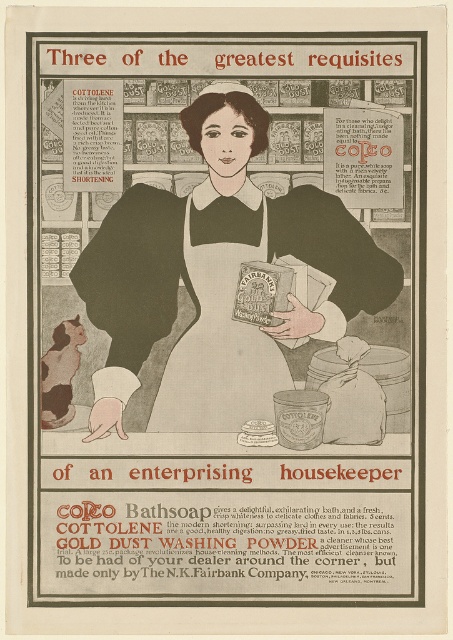
Can you confirm if matte black apron at center is positioned to the right of matte cardboard box at center?

No, matte black apron at center is not to the right of matte cardboard box at center.

Is the position of matte black apron at center more distant than that of matte cardboard box at center?

No.

Is point (297, 236) behind point (242, 426)?

Yes.

Identify the location of matte black apron at center. (217, 278).

Which is more to the right, white cotton apron at center or matte cardboard box at center?

Positioned to the right is matte cardboard box at center.

Between point (236, 369) and point (244, 433), which one is positioned in front?

Point (236, 369)

Is point (221, 257) closer to viewer compared to point (244, 435)?

That is False.

The image size is (453, 640). I want to click on white cotton apron at center, so click(220, 337).

Between matte black apron at center and white cotton apron at center, which one has more height?

With more height is matte black apron at center.

Does matte black apron at center come behind white cotton apron at center?

No, matte black apron at center is closer to the viewer.

Is point (251, 115) closer to viewer compared to point (276, 348)?

No, (251, 115) is behind (276, 348).

The image size is (453, 640). What are the coordinates of `matte black apron at center` in the screenshot? It's located at (217, 278).